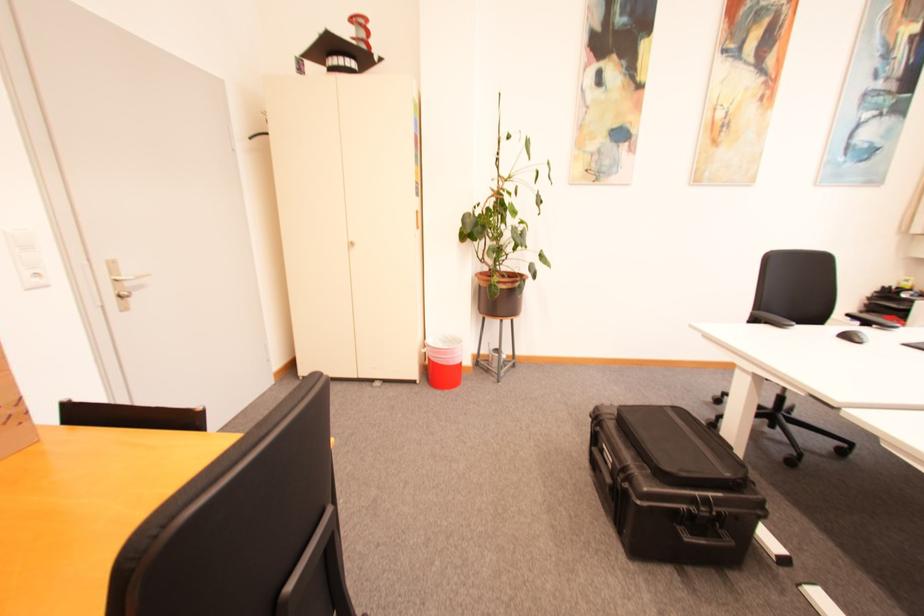
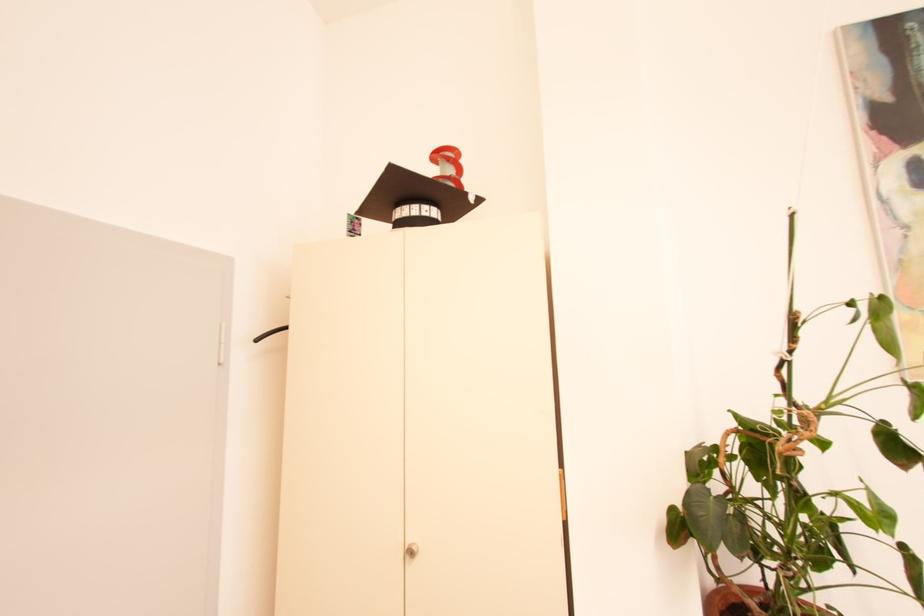
The point at (383, 59) is marked in the first image. Where is the corresponding point in the second image?

(478, 199)